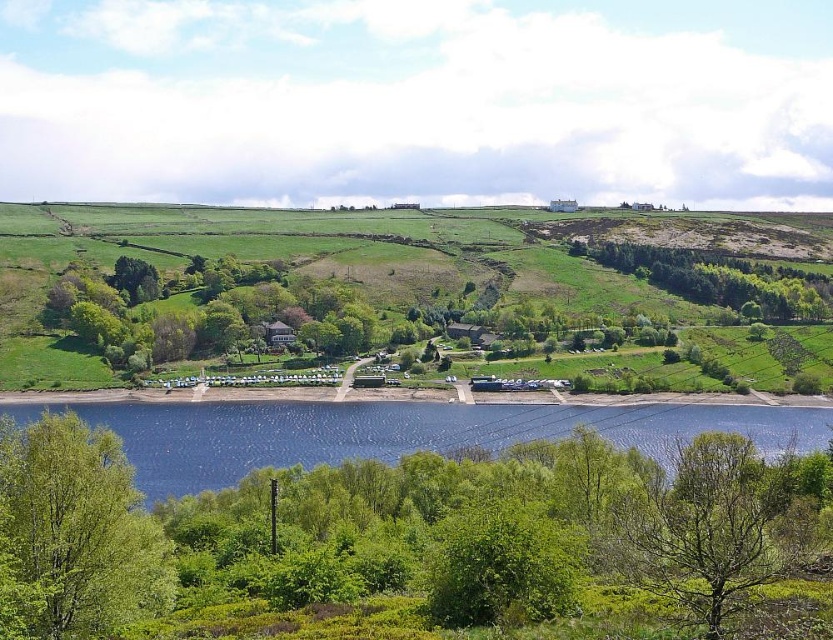
You are standing at the center of the image and want to find the green leafy tree at lower left. Which direction should you look to locate it?

The green leafy tree at lower left is located at the lower left direction from your current position at the center of the image.

You are planning to build a dock that extends from the green leafy trees at right to the blue water at lower center. Given that the dock must be at least 600 feet long to reach the water, will the proposed dock length of 650 feet be sufficient?

The blue water at lower center is 646.21 feet from the green leafy trees at right. A dock of 650 feet is longer than the required distance, so it will be sufficient to reach the water.